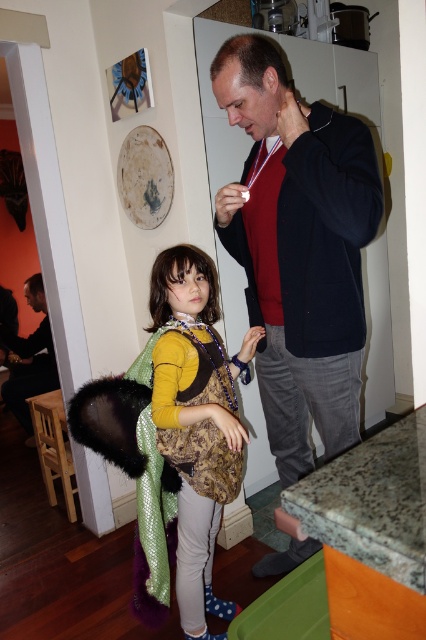
Is point (216, 605) in front of point (37, 332)?

Yes, it is in front of point (37, 332).

Can you confirm if patterned fabric dress at center is bigger than dark brown leather jacket at left?

Incorrect, patterned fabric dress at center is not larger than dark brown leather jacket at left.

Describe the element at coordinates (196, 420) in the screenshot. This screenshot has width=426, height=640. I see `patterned fabric dress at center` at that location.

Find the location of a particular element. Image resolution: width=426 pixels, height=640 pixels. patterned fabric dress at center is located at coordinates (196, 420).

Can you confirm if dark blue sweater at center is wider than patterned fabric dress at center?

Yes.

Does dark blue sweater at center lie in front of patterned fabric dress at center?

That is True.

This screenshot has width=426, height=640. Describe the element at coordinates (299, 248) in the screenshot. I see `dark blue sweater at center` at that location.

This screenshot has height=640, width=426. What are the coordinates of `dark blue sweater at center` in the screenshot? It's located at (299, 248).

Can you confirm if dark blue sweater at center is bigger than dark brown leather jacket at left?

Actually, dark blue sweater at center might be smaller than dark brown leather jacket at left.

Which is behind, point (253, 84) or point (28, 387)?

Positioned behind is point (28, 387).

The width and height of the screenshot is (426, 640). In order to click on dark blue sweater at center in this screenshot , I will do `click(299, 248)`.